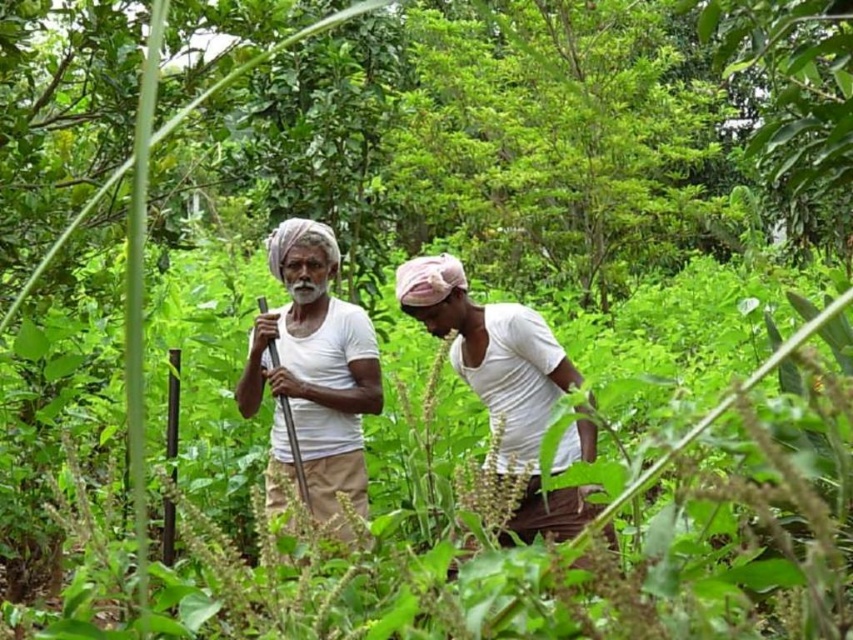
You are a gardener standing in the middle of the garden. You notice the green leafy tree at center and the white cotton shirt at center. Which object is taller?

The white cotton shirt at center is taller than the green leafy tree at center.

You are standing in the garden and want to water the green leafy tree at center. Your water tank is 10 meters away from you. Can you reach the tree with your hose if the hose is 12 meters long?

The distance between you and the green leafy tree at center is 15.14 meters. The water tank is 10 meters away from you, so the total distance from the water tank to the tree is 15.14m minus 10m equals 5.14 meters. Since the hose is 12 meters long, which is longer than 5.14 meters, you can reach the tree with the hose.